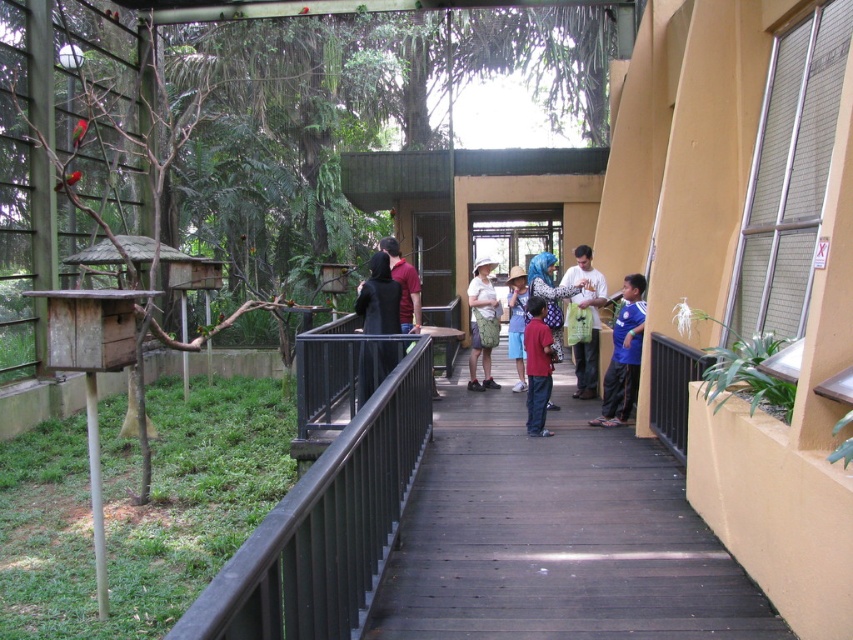
Between black metal/rail at lower center and blue printed shirt at center, which one is positioned lower?

black metal/rail at lower center is below.

Does point (262, 556) come behind point (625, 308)?

No, (262, 556) is in front of (625, 308).

Is point (329, 564) closer to viewer compared to point (595, 317)?

Yes, point (329, 564) is closer to viewer.

Where is `black metal/rail at lower center`? This screenshot has height=640, width=853. black metal/rail at lower center is located at coordinates (326, 528).

Does point (592, 545) lie in front of point (587, 365)?

That is True.

Which is behind, point (543, 461) or point (576, 381)?

The point (576, 381) is behind.

This screenshot has width=853, height=640. In order to click on wooden walkway at center in this screenshot , I will do `click(556, 538)`.

Find the location of a particular element. The image size is (853, 640). wooden walkway at center is located at coordinates (556, 538).

Consider the image. Does black matte jacket at center appear on the left side of camouflage shorts at center?

Correct, you'll find black matte jacket at center to the left of camouflage shorts at center.

Is black matte jacket at center positioned before camouflage shorts at center?

Yes, black matte jacket at center is closer to the viewer.

Identify the location of black matte jacket at center. (379, 298).